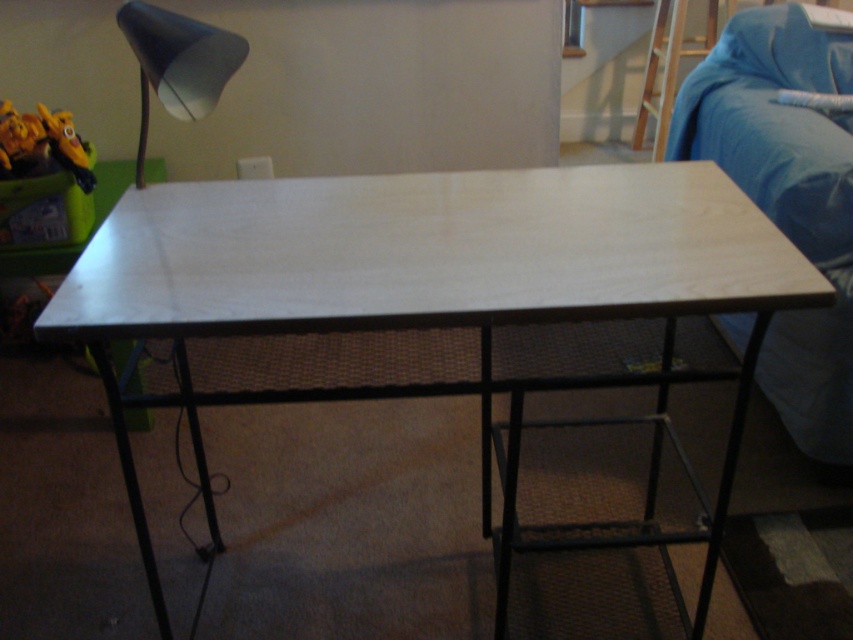
You are planning to place a rectangular rug under both the bare wood table at center and the blue fabric couch at right. Based on their widths, which object requires a wider rug to fully cover its surface?

The bare wood table at center requires a wider rug because its width surpasses that of the blue fabric couch at right.

You are standing in front of the table and want to place an object on the table. You have two points to choose from, point (181,372) and point (688,54). Which point is closer to you?

Point (181,372) is closer to the viewer than point (688,54), so you should choose point (181,372) as it is nearer to your current position.